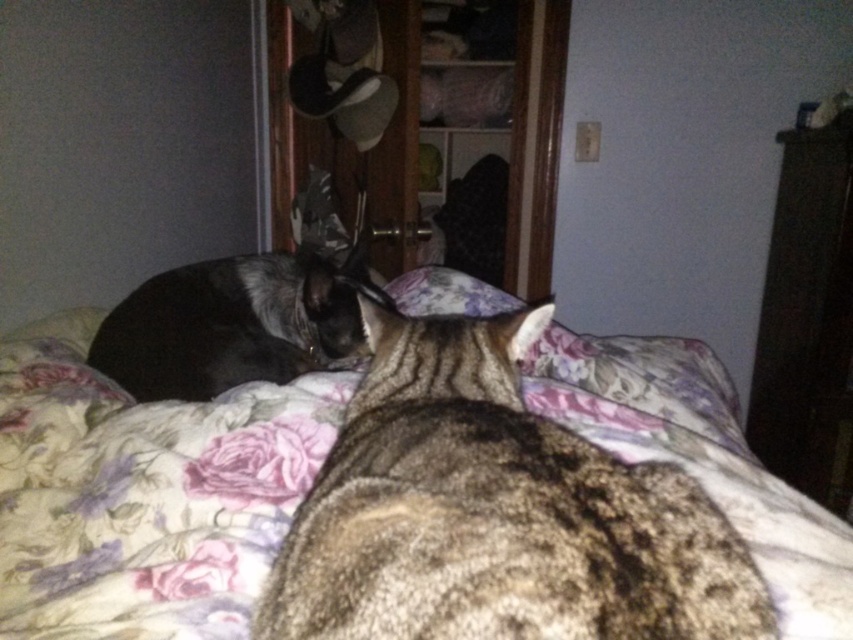
Question: Can you confirm if dark wood dresser at right is positioned above tabby fur at left?

Choices:
 (A) yes
 (B) no

Answer: (A)

Question: Does floral fabric bed at center have a greater width compared to tabby fur at left?

Choices:
 (A) no
 (B) yes

Answer: (B)

Question: Estimate the real-world distances between objects in this image. Which object is closer to the tabby fur at left?

Choices:
 (A) floral fabric bed at center
 (B) dark wood dresser at right

Answer: (A)

Question: Considering the real-world distances, which object is closest to the tabby fur at left?

Choices:
 (A) dark wood dresser at right
 (B) floral fabric bed at center

Answer: (B)

Question: Is the position of floral fabric bed at center more distant than that of dark wood dresser at right?

Choices:
 (A) yes
 (B) no

Answer: (B)

Question: Which object is the closest to the floral fabric bed at center?

Choices:
 (A) dark wood dresser at right
 (B) tabby fur at left

Answer: (B)